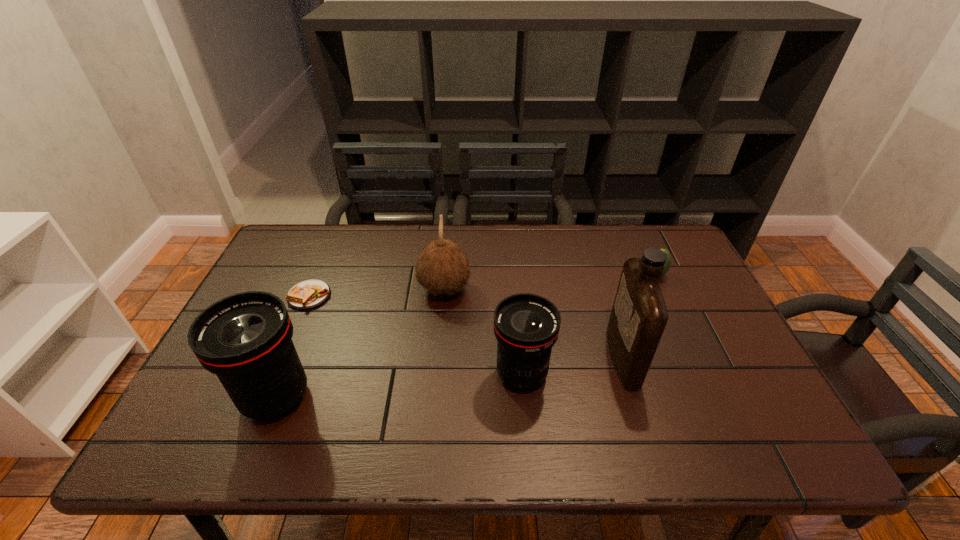
Find the location of a particular element. vacant region located on the back of the right telephoto lens is located at coordinates (516, 302).

Locate an element on the screen. This screenshot has width=960, height=540. free space located on the left of the rightmost object is located at coordinates (519, 274).

Where is `vacant space located on the back of the sandwich`? The height and width of the screenshot is (540, 960). vacant space located on the back of the sandwich is located at coordinates (324, 259).

At what (x,y) coordinates should I click in order to perform the action: click on vacant space located on the surface of the coconut. Please return your answer as a coordinate pair (x, y). Image resolution: width=960 pixels, height=540 pixels. Looking at the image, I should click on (558, 289).

At what (x,y) coordinates should I click in order to perform the action: click on vacant area located 0.190m on the label side of the tallest object. Please return your answer as a coordinate pair (x, y). Image resolution: width=960 pixels, height=540 pixels. Looking at the image, I should click on (534, 357).

I want to click on free region located on the label side of the tallest object, so (473, 357).

Where is `free space located 0.160m on the label side of the tallest object`? free space located 0.160m on the label side of the tallest object is located at coordinates (546, 357).

Find the location of `object present at the far edge`. object present at the far edge is located at coordinates (668, 262).

Where is `liquor positioned at the near edge`? liquor positioned at the near edge is located at coordinates (639, 315).

What are the coordinates of `telephoto lens at the left edge` in the screenshot? It's located at (245, 339).